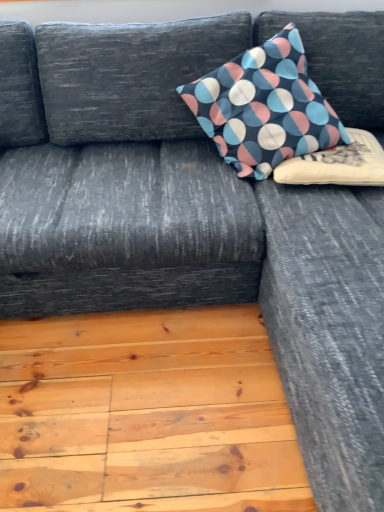
Question: From the image's perspective, relative to patterned fabric pillow at upper center, the 2th pillow when ordered from bottom to top, is soft cotton cushion at upper right, the 1th pillow in the bottom-to-top sequence, above or below?

Choices:
 (A) above
 (B) below

Answer: (B)

Question: Is soft cotton cushion at upper right, the 2th pillow when ordered from top to bottom, in front of or behind patterned fabric pillow at upper center, positioned as the 1th pillow in top-to-bottom order, in the image?

Choices:
 (A) behind
 (B) front

Answer: (A)

Question: Considering the positions of soft cotton cushion at upper right, the 1th pillow in the bottom-to-top sequence, and patterned fabric pillow at upper center, the 2th pillow when ordered from bottom to top, in the image, is soft cotton cushion at upper right, the 1th pillow in the bottom-to-top sequence, wider or thinner than patterned fabric pillow at upper center, the 2th pillow when ordered from bottom to top,?

Choices:
 (A) wide
 (B) thin

Answer: (B)

Question: Based on their sizes in the image, would you say patterned fabric pillow at upper center, the 2th pillow when ordered from bottom to top, is bigger or smaller than soft cotton cushion at upper right, the 2th pillow when ordered from top to bottom?

Choices:
 (A) small
 (B) big

Answer: (B)

Question: Considering the positions of point (205, 79) and point (355, 157), is point (205, 79) closer or farther from the camera than point (355, 157)?

Choices:
 (A) closer
 (B) farther

Answer: (B)

Question: In terms of width, does patterned fabric pillow at upper center, the 2th pillow when ordered from bottom to top, look wider or thinner when compared to soft cotton cushion at upper right, the 1th pillow in the bottom-to-top sequence?

Choices:
 (A) thin
 (B) wide

Answer: (B)

Question: Choose the correct answer: Is patterned fabric pillow at upper center, positioned as the 1th pillow in top-to-bottom order, inside soft cotton cushion at upper right, the 1th pillow in the bottom-to-top sequence, or outside it?

Choices:
 (A) outside
 (B) inside

Answer: (A)